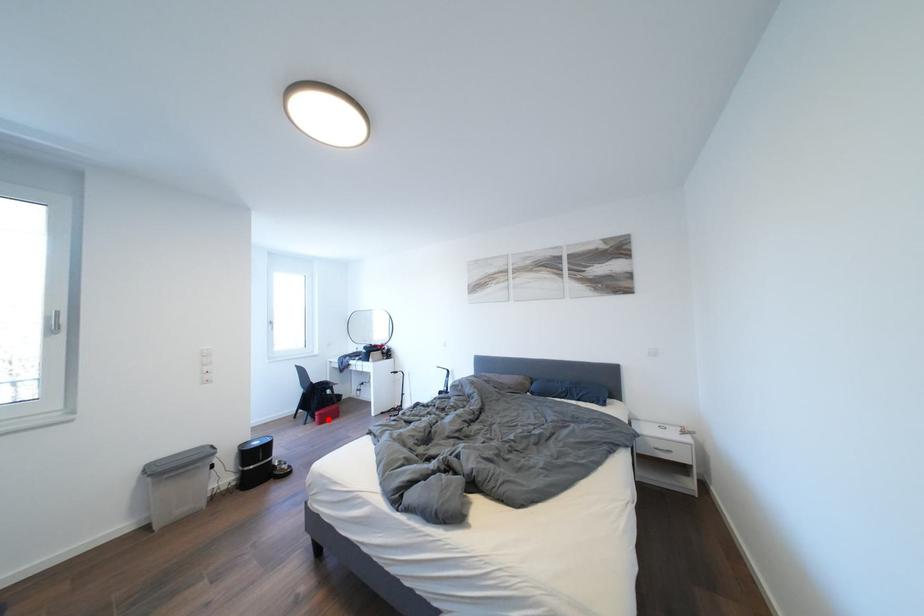
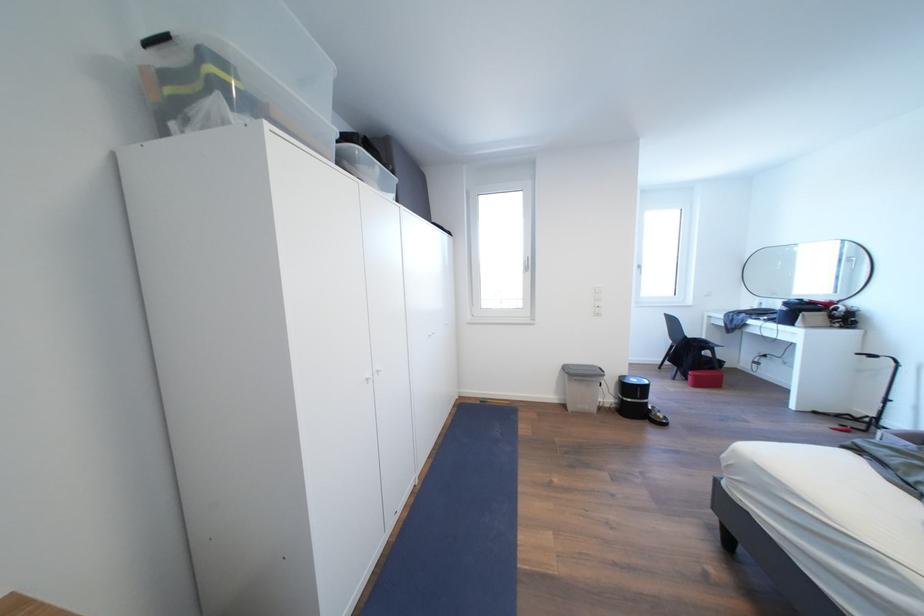
Question: I am providing you with two images of the same scene from different viewpoints. A red point is marked on the first image. At the location where the point appears in image 1, is it still visible in image 2?

Choices:
 (A) Yes
 (B) No

Answer: (A)